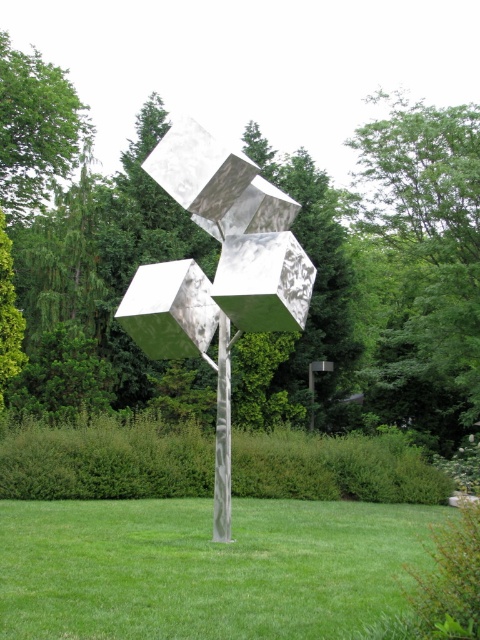
You are an art student analyzing the sculpture. Based on the scene, which object is taller between the metallic cubes at center and the metallic polished pole at center?

The metallic polished pole at center is taller than the metallic cubes at center.

You are standing in the park looking at the sculpture. Which object is closer to you between the green leafy tree at center and the green grass at center?

The green leafy tree at center is closer to you because the green grass at center is behind it.